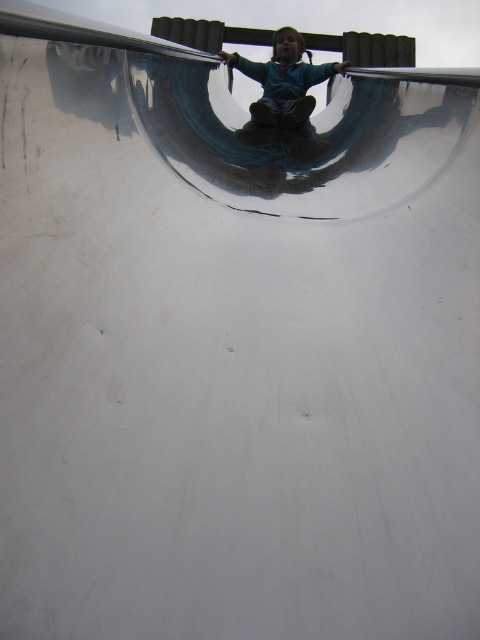
You are standing in front of the slide and see two points marked on the slide. The first point is at coordinates point (277, 100) and the second is at point (269, 141). Which point is closer to you?

Point (277, 100) is further to the camera than point (269, 141), so the point closer to you is point (269, 141).

You are a photographer trying to capture the reflection of the blue matte jacket at upper center and the shiny blue skateboard at upper center on the slide. Which object will appear more to the left in the reflection?

The blue matte jacket at upper center is positioned on the left side of the shiny blue skateboard at upper center, so its reflection will also be more to the left.